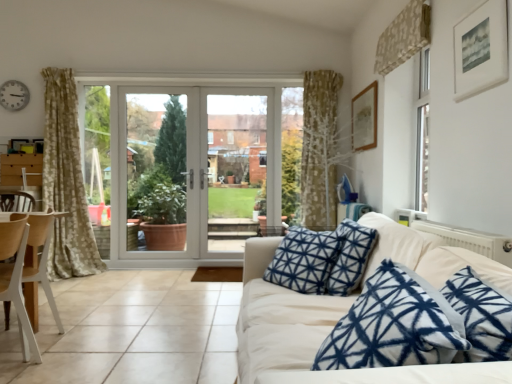
Question: In terms of height, does white wood chair at lower left look taller or shorter compared to white plastic clock at upper left?

Choices:
 (A) tall
 (B) short

Answer: (A)

Question: Considering the relative positions of white wood chair at lower left and white plastic clock at upper left in the image provided, is white wood chair at lower left to the left or to the right of white plastic clock at upper left?

Choices:
 (A) right
 (B) left

Answer: (A)

Question: Estimate the real-world distances between objects in this image. Which object is closer to the wooden picture frame at upper right, arranged as the second picture frame when viewed from the front?

Choices:
 (A) beige textured curtain at upper right
 (B) white glossy door at center
 (C) white wood chair at left
 (D) white matte picture frame at upper right, the second picture frame positioned from the back
 (E) clear glass door at center

Answer: (A)

Question: Considering the real-world distances, which object is closest to the white wood chair at left?

Choices:
 (A) white matte picture frame at upper right, the first picture frame when ordered from front to back
 (B) clear glass door at center
 (C) beige textured curtain at upper right
 (D) white glossy door at center
 (E) wooden picture frame at upper right, placed as the first picture frame when sorted from back to front

Answer: (A)